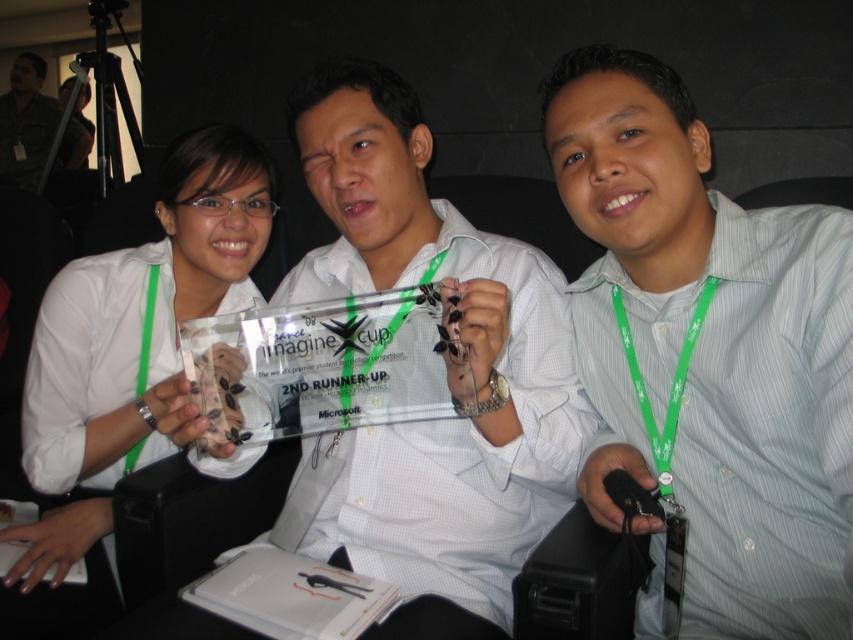
Question: Which of the following is the farthest from the observer?

Choices:
 (A) green fabric lanyard at center
 (B) clear acrylic trophy at center
 (C) green striped shirt at center
 (D) matte white trophy at center

Answer: (A)

Question: Can you confirm if clear acrylic trophy at center is smaller than matte white trophy at center?

Choices:
 (A) no
 (B) yes

Answer: (B)

Question: Does clear acrylic trophy at center lie behind green fabric lanyard at center?

Choices:
 (A) no
 (B) yes

Answer: (A)

Question: Estimate the real-world distances between objects in this image. Which object is closer to the clear acrylic trophy at center?

Choices:
 (A) matte white trophy at center
 (B) green striped shirt at center
 (C) green fabric lanyard at center

Answer: (B)

Question: Which object appears closest to the camera in this image?

Choices:
 (A) green striped shirt at center
 (B) green fabric lanyard at center
 (C) matte white trophy at center
 (D) clear acrylic trophy at center

Answer: (A)

Question: Is green striped shirt at center above clear acrylic trophy at center?

Choices:
 (A) yes
 (B) no

Answer: (B)